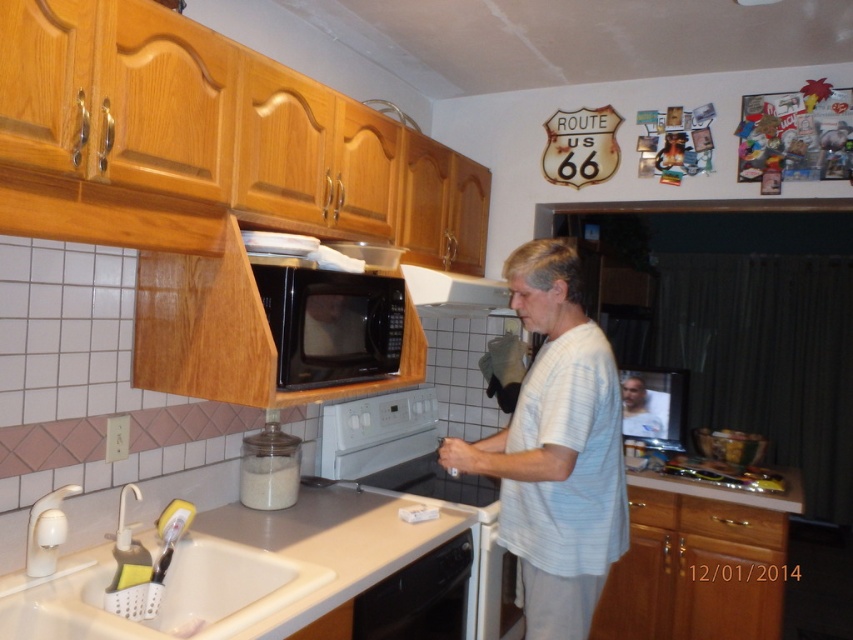
Between white ceramic sink at lower left and white matte shirt at center, which one has less height?

white ceramic sink at lower left is shorter.

Is point (241, 545) positioned behind point (653, 428)?

That is False.

Locate an element on the screen. white ceramic sink at lower left is located at coordinates [161, 595].

Which is more to the right, black plastic dishwasher at lower center or white matte shirt at center?

white matte shirt at center is more to the right.

Who is more forward, [378,584] or [630,433]?

Positioned in front is point [378,584].

Is point (395, 579) behind point (639, 392)?

No.

Where is `black plastic dishwasher at lower center`? This screenshot has height=640, width=853. black plastic dishwasher at lower center is located at coordinates point(418,596).

Between white matte jar at sink and white matte shirt at center, which one appears on the right side from the viewer's perspective?

white matte shirt at center is more to the right.

From the picture: Who is lower down, white matte jar at sink or white matte shirt at center?

white matte jar at sink is below.

The width and height of the screenshot is (853, 640). Describe the element at coordinates (268, 481) in the screenshot. I see `white matte jar at sink` at that location.

The width and height of the screenshot is (853, 640). I want to click on white matte jar at sink, so click(x=268, y=481).